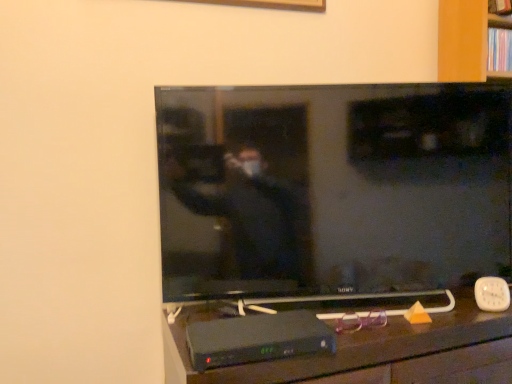
Where is `vacant space in flat screen tv at center (from a real-world perspective)`? This screenshot has height=384, width=512. vacant space in flat screen tv at center (from a real-world perspective) is located at coordinates (347, 310).